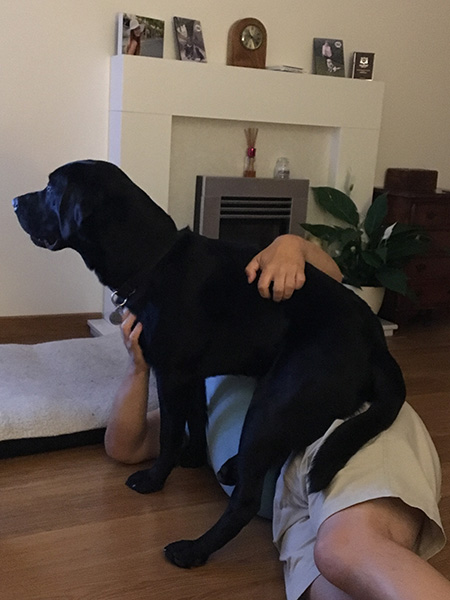
Where is `fireplace`? fireplace is located at coordinates (250, 194).